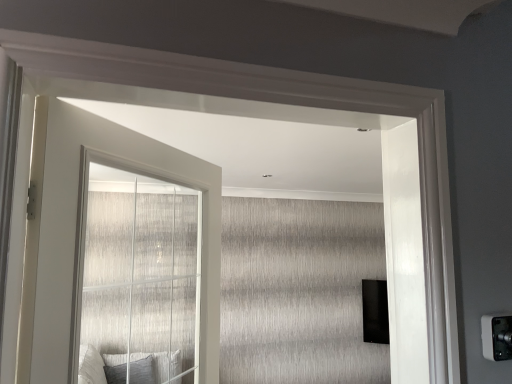
What do you see at coordinates (76, 225) in the screenshot? I see `white glossy door at upper center` at bounding box center [76, 225].

Measure the distance between point (x=213, y=196) and camera.

Point (x=213, y=196) is 1.55 meters from camera.

In order to face white glossy door at upper center, should I rotate leftwards or rightwards?

You should rotate left by 13.778 degrees.

This screenshot has height=384, width=512. I want to click on white glossy door at upper center, so click(76, 225).

You are a GUI agent. You are given a task and a screenshot of the screen. Output one action in this format:
    pyautogui.click(x=<x>, y=<y>)
    Task: Click on the white glossy door at upper center
    
    Given the screenshot: What is the action you would take?
    pyautogui.click(x=76, y=225)